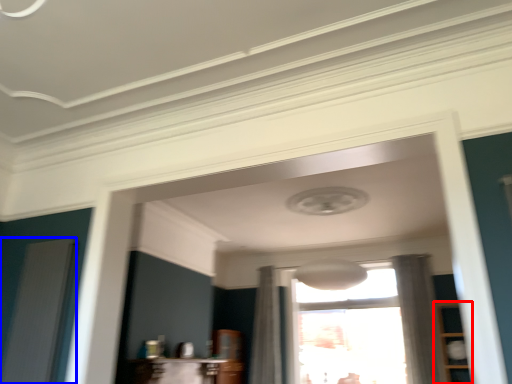
Question: Which object is closer to the camera taking this photo, cabinetry (highlighted by a red box) or screen door (highlighted by a blue box)?

Choices:
 (A) cabinetry
 (B) screen door

Answer: (B)